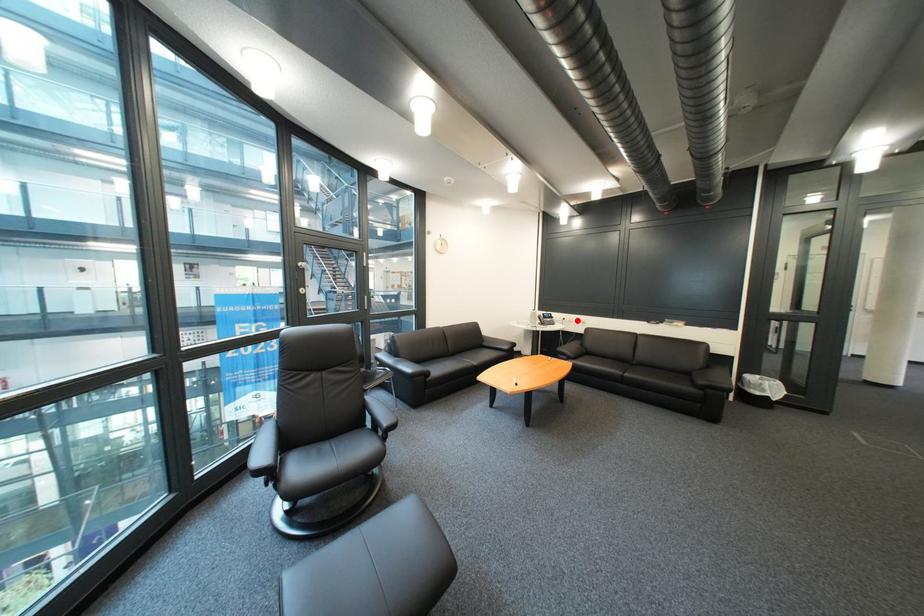
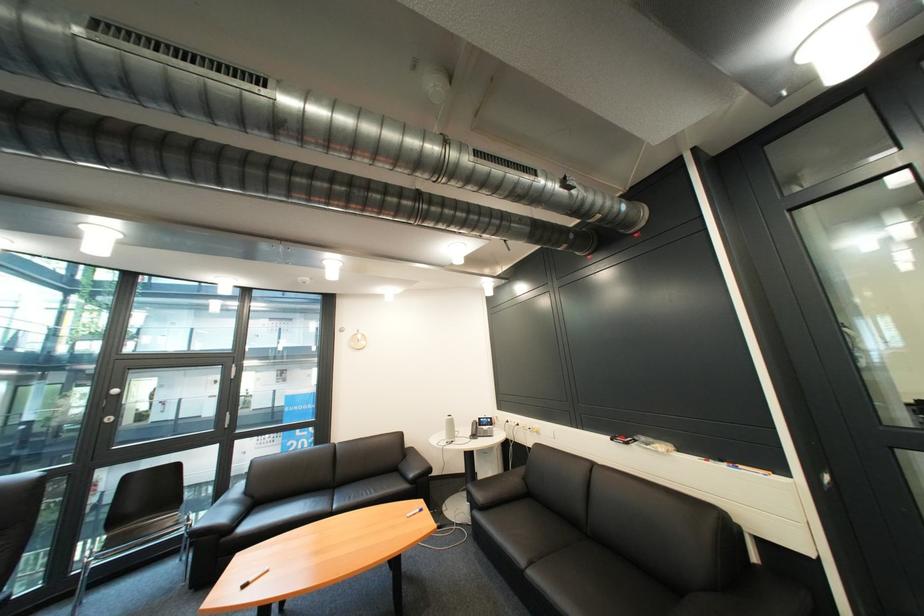
Question: I am providing you with two images of the same scene from different viewpoints. Image1 has a red point marked. In image2, the corresponding 3D location appears at what relative position? Reply with the corresponding letter.

Choices:
 (A) Closer
 (B) Farther

Answer: (B)